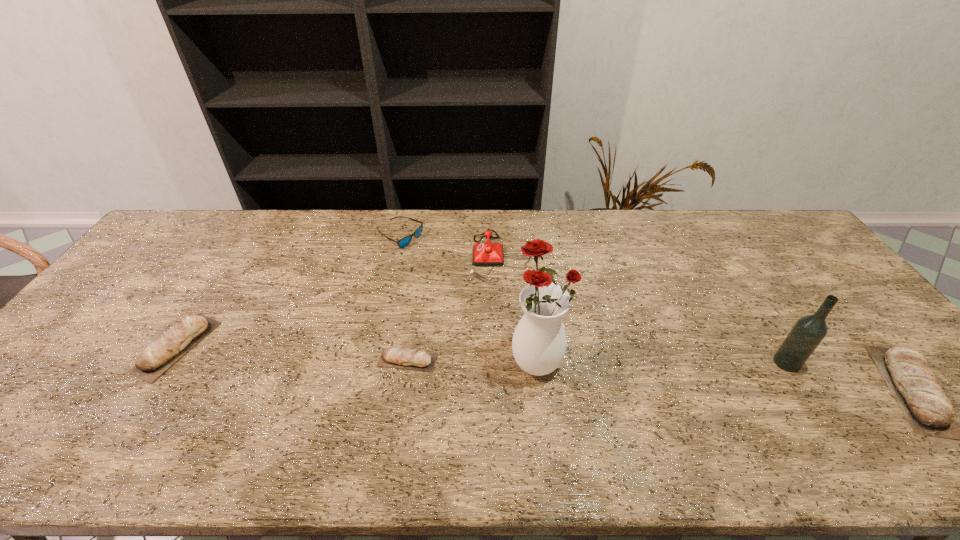
I want to click on vacant space located on the left of the shortest object, so click(x=240, y=360).

Find the location of a particular element. The width and height of the screenshot is (960, 540). vacant space situated at the front of the sunglasses showing the lenses is located at coordinates pos(450,238).

Where is `vacant area located on the dial of the fifth shortest object`? vacant area located on the dial of the fifth shortest object is located at coordinates (396, 257).

You are a GUI agent. You are given a task and a screenshot of the screen. Output one action in this format:
    pyautogui.click(x=<x>, y=<y>)
    Task: Click on the vacant area situated on the dial of the fifth shortest object
    The height and width of the screenshot is (540, 960).
    Given the screenshot: What is the action you would take?
    pyautogui.click(x=352, y=257)

Where is `vacant space located 0.190m on the dial of the fifth shortest object`? vacant space located 0.190m on the dial of the fifth shortest object is located at coordinates (411, 257).

The image size is (960, 540). What are the coordinates of `vacant point located 0.320m on the left of the sixth shortest object` in the screenshot? It's located at (648, 362).

Where is `vacant space situated on the back of the tallest object`? This screenshot has width=960, height=540. vacant space situated on the back of the tallest object is located at coordinates (525, 257).

The width and height of the screenshot is (960, 540). Identify the location of sunglasses that is at the far edge. (405, 241).

This screenshot has height=540, width=960. Identify the location of telephone at the far edge. (484, 254).

At what (x,y) coordinates should I click in order to perform the action: click on vacant area at the far edge of the desktop. Please return your answer as a coordinate pair (x, y). The image size is (960, 540). Looking at the image, I should click on (543, 223).